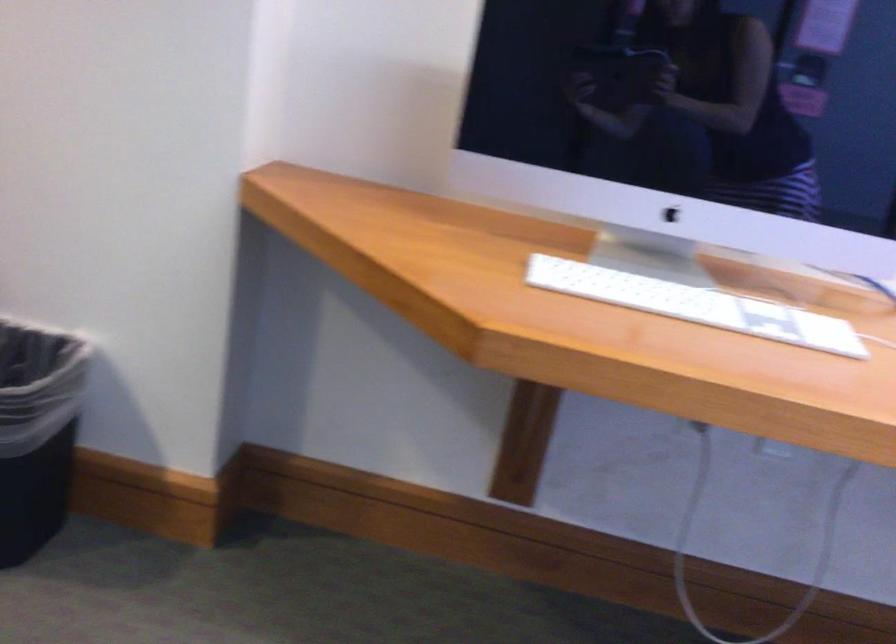
Find where to lift the white keyboard. Please return your answer as a coordinate pair (x, y).

(695, 305)